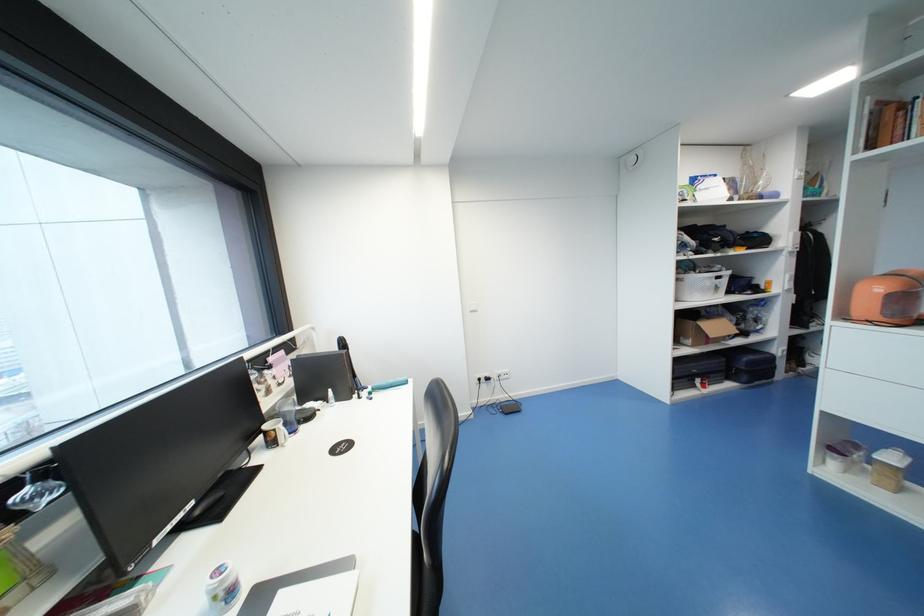
Find where to lift the blue glass. Please return your answer as a coordinate pair (x, y).

(287, 411)